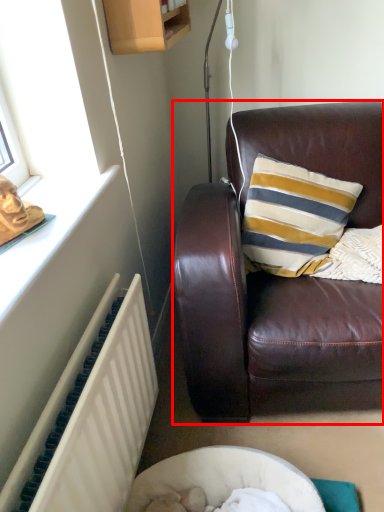
Question: From the image's perspective, where is studio couch (annotated by the red box) located relative to radiator?

Choices:
 (A) above
 (B) below

Answer: (A)